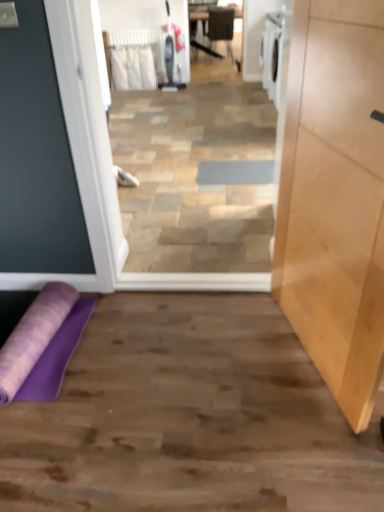
Image resolution: width=384 pixels, height=512 pixels. What do you see at coordinates (235, 172) in the screenshot?
I see `gray fabric doormat at center` at bounding box center [235, 172].

Measure the distance between purple fabric yoga mat at lower left and camera.

The distance of purple fabric yoga mat at lower left from camera is 1.58 meters.

Locate an element on the screen. light wood cabinet at right is located at coordinates (335, 197).

Considering the positions of objects light wood cabinet at right and purple fabric yoga mat at lower left in the image provided, who is behind, light wood cabinet at right or purple fabric yoga mat at lower left?

purple fabric yoga mat at lower left is more distant.

From a real-world perspective, is light wood cabinet at right positioned over purple fabric yoga mat at lower left based on gravity?

Yes, from a real-world perspective, light wood cabinet at right is over purple fabric yoga mat at lower left

Is light wood cabinet at right to the right of purple fabric yoga mat at lower left from the viewer's perspective?

Correct, you'll find light wood cabinet at right to the right of purple fabric yoga mat at lower left.

Would you consider light wood cabinet at right to be distant from purple fabric yoga mat at lower left?

Yes, light wood cabinet at right is far from purple fabric yoga mat at lower left.

Is light wood cabinet at right turned away from matte black chair at center?

No, light wood cabinet at right is not facing the opposite direction of matte black chair at center.

Considering the sizes of objects light wood cabinet at right and matte black chair at center in the image provided, who is taller, light wood cabinet at right or matte black chair at center?

light wood cabinet at right is taller.

From a real-world perspective, is light wood cabinet at right on top of matte black chair at center?

Correct, in the physical world, light wood cabinet at right is higher than matte black chair at center.

Which object is thinner, gray fabric doormat at center or purple fabric yoga mat at lower left?

gray fabric doormat at center.

Does gray fabric doormat at center appear on the left side of purple fabric yoga mat at lower left?

No.

Is gray fabric doormat at center not close to purple fabric yoga mat at lower left?

gray fabric doormat at center is far away from purple fabric yoga mat at lower left.

Considering the sizes of objects gray fabric doormat at center and purple fabric yoga mat at lower left in the image provided, who is taller, gray fabric doormat at center or purple fabric yoga mat at lower left?

Standing taller between the two is purple fabric yoga mat at lower left.

What's the angular difference between matte black chair at center and light wood cabinet at right's facing directions?

matte black chair at center and light wood cabinet at right are facing 101 degrees away from each other.

Is the position of matte black chair at center less distant than that of light wood cabinet at right?

No, matte black chair at center is further to the viewer.

Would you say matte black chair at center is inside or outside light wood cabinet at right?

matte black chair at center is spatially situated outside light wood cabinet at right.

Considering the relative sizes of matte black chair at center and light wood cabinet at right in the image provided, is matte black chair at center smaller than light wood cabinet at right?

Actually, matte black chair at center might be larger than light wood cabinet at right.

Considering the positions of objects light wood cabinet at right and gray fabric doormat at center in the image provided, who is more to the right, light wood cabinet at right or gray fabric doormat at center?

Positioned to the right is light wood cabinet at right.

Does light wood cabinet at right have a smaller size compared to gray fabric doormat at center?

Incorrect, light wood cabinet at right is not smaller in size than gray fabric doormat at center.

Find the location of `cabinetry lying in front of the gray fabric doormat at center`. cabinetry lying in front of the gray fabric doormat at center is located at coordinates (335, 197).

Considering the positions of points (352, 269) and (263, 173), is point (352, 269) farther from camera compared to point (263, 173)?

No, it is in front of (263, 173).

Considering the relative sizes of gray fabric doormat at center and matte black chair at center in the image provided, is gray fabric doormat at center thinner than matte black chair at center?

In fact, gray fabric doormat at center might be wider than matte black chair at center.

Is gray fabric doormat at center bigger or smaller than matte black chair at center?

In the image, gray fabric doormat at center appears to be smaller than matte black chair at center.

Is gray fabric doormat at center with matte black chair at center?

No, gray fabric doormat at center is not touching matte black chair at center.

Which object is positioned more to the right, purple fabric yoga mat at lower left or matte black chair at center?

Positioned to the right is matte black chair at center.

From a real-world perspective, is purple fabric yoga mat at lower left on matte black chair at center?

No, from a real-world perspective, purple fabric yoga mat at lower left is not on top of matte black chair at center.

Considering the sizes of objects purple fabric yoga mat at lower left and matte black chair at center in the image provided, who is thinner, purple fabric yoga mat at lower left or matte black chair at center?

Thinner between the two is matte black chair at center.

How many degrees apart are the facing directions of purple fabric yoga mat at lower left and matte black chair at center?

purple fabric yoga mat at lower left and matte black chair at center are facing 173 degrees away from each other.

Where is `beach towel that appears below the light wood cabinet at right (from a real-world perspective)`? The height and width of the screenshot is (512, 384). beach towel that appears below the light wood cabinet at right (from a real-world perspective) is located at coordinates point(33,336).

Identify the location of cabinetry lying on the left of matte black chair at center. (335, 197).

Looking at the image, which one is located closer to matte black chair at center, gray fabric doormat at center or purple fabric yoga mat at lower left?

gray fabric doormat at center lies closer to matte black chair at center than the other object.

Based on their spatial positions, is matte black chair at center or light wood cabinet at right further from purple fabric yoga mat at lower left?

matte black chair at center lies further to purple fabric yoga mat at lower left than the other object.

Estimate the real-world distances between objects in this image. Which object is closer to light wood cabinet at right, gray fabric doormat at center or purple fabric yoga mat at lower left?

Based on the image, purple fabric yoga mat at lower left appears to be nearer to light wood cabinet at right.

From the picture: Based on their spatial positions, is light wood cabinet at right or purple fabric yoga mat at lower left further from gray fabric doormat at center?

purple fabric yoga mat at lower left is further to gray fabric doormat at center.

Based on the photo, when comparing their distances from light wood cabinet at right, does matte black chair at center or gray fabric doormat at center seem further?

The object further to light wood cabinet at right is matte black chair at center.

Looking at the image, which one is located further to matte black chair at center, light wood cabinet at right or gray fabric doormat at center?

The object further to matte black chair at center is light wood cabinet at right.

When comparing their distances from gray fabric doormat at center, does matte black chair at center or purple fabric yoga mat at lower left seem closer?

The object closer to gray fabric doormat at center is purple fabric yoga mat at lower left.

Considering their positions, is matte black chair at center positioned closer to purple fabric yoga mat at lower left than gray fabric doormat at center?

Based on the image, gray fabric doormat at center appears to be nearer to purple fabric yoga mat at lower left.

You are a GUI agent. You are given a task and a screenshot of the screen. Output one action in this format:
    pyautogui.click(x=<x>, y=<y>)
    Task: Click on the beach towel positioned between light wood cabinet at right and gray fabric doormat at center from near to far
    Image resolution: width=384 pixels, height=512 pixels.
    Given the screenshot: What is the action you would take?
    pyautogui.click(x=33, y=336)

Identify the location of doormat located between light wood cabinet at right and matte black chair at center in the depth direction. (235, 172).

At what (x,y) coordinates should I click in order to perform the action: click on beach towel positioned between light wood cabinet at right and matte black chair at center from near to far. Please return your answer as a coordinate pair (x, y). The width and height of the screenshot is (384, 512). Looking at the image, I should click on (33, 336).

You are a GUI agent. You are given a task and a screenshot of the screen. Output one action in this format:
    pyautogui.click(x=<x>, y=<y>)
    Task: Click on the doormat between purple fabric yoga mat at lower left and matte black chair at center from front to back
    
    Given the screenshot: What is the action you would take?
    coord(235,172)